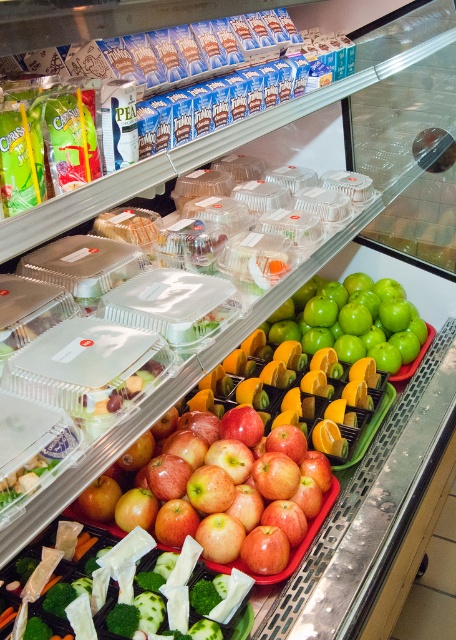
You are a grocery store employee who needs to restock the refrigerated display case. You have a new shipment of red matte apples at center and green leafy vegetables at center. Based on the current arrangement, where should you place the new items to maintain the existing layout?

The red matte apples at center should be placed over the green leafy vegetables at center to maintain the existing layout.